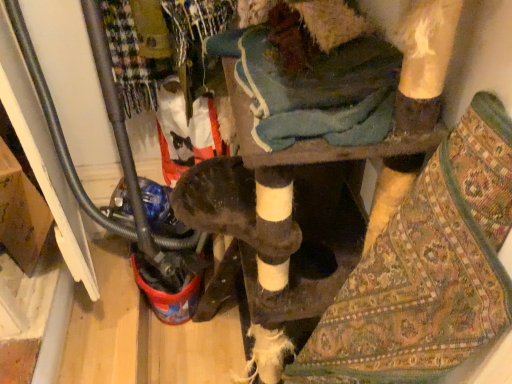
The image size is (512, 384). In order to click on metallic gray water pipe at lower left in this screenshot , I will do `click(73, 165)`.

This screenshot has width=512, height=384. What do you see at coordinates (73, 165) in the screenshot? I see `metallic gray water pipe at lower left` at bounding box center [73, 165].

Find the location of a particular element. metallic gray water pipe at lower left is located at coordinates (73, 165).